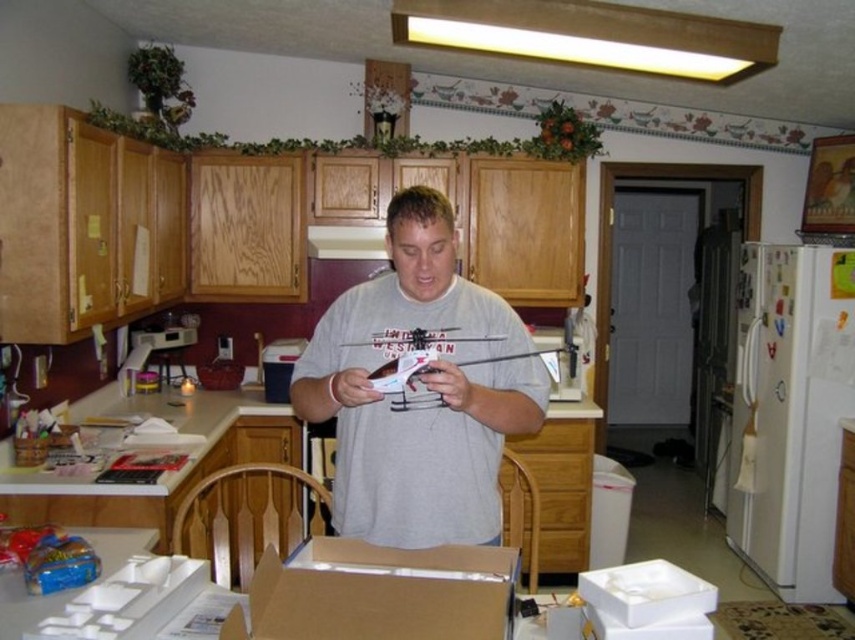
Does point (338, 608) come behind point (600, 573)?

No, (338, 608) is closer to viewer.

Is cardboard at lower center smaller than white matte box at lower right?

No.

Locate an element on the screen. cardboard at lower center is located at coordinates (379, 593).

Who is higher up, gray matte shirt at center or cardboard at lower center?

gray matte shirt at center is above.

Can you confirm if gray matte shirt at center is thinner than cardboard at lower center?

In fact, gray matte shirt at center might be wider than cardboard at lower center.

Does point (392, 314) lie behind point (500, 604)?

Yes, it is behind point (500, 604).

At what (x,y) coordinates should I click in order to perform the action: click on gray matte shirt at center. Please return your answer as a coordinate pair (x, y). Looking at the image, I should click on (425, 387).

Who is shorter, gray matte shirt at center or white glossy exhaust hood at upper center?

With less height is white glossy exhaust hood at upper center.

Is point (401, 432) in front of point (363, 241)?

Yes, point (401, 432) is in front of point (363, 241).

Where is `gray matte shirt at center`? This screenshot has height=640, width=855. gray matte shirt at center is located at coordinates (425, 387).